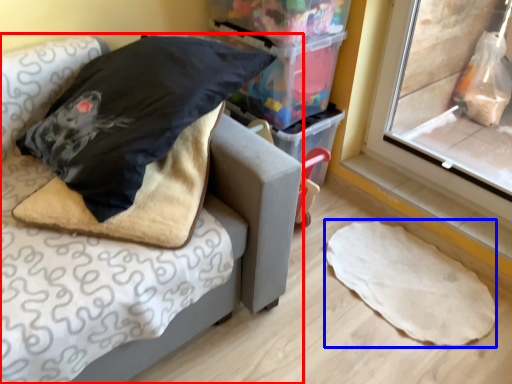
Question: Which object appears farthest to the camera in this image, furniture (highlighted by a red box) or linen (highlighted by a blue box)?

Choices:
 (A) furniture
 (B) linen

Answer: (B)